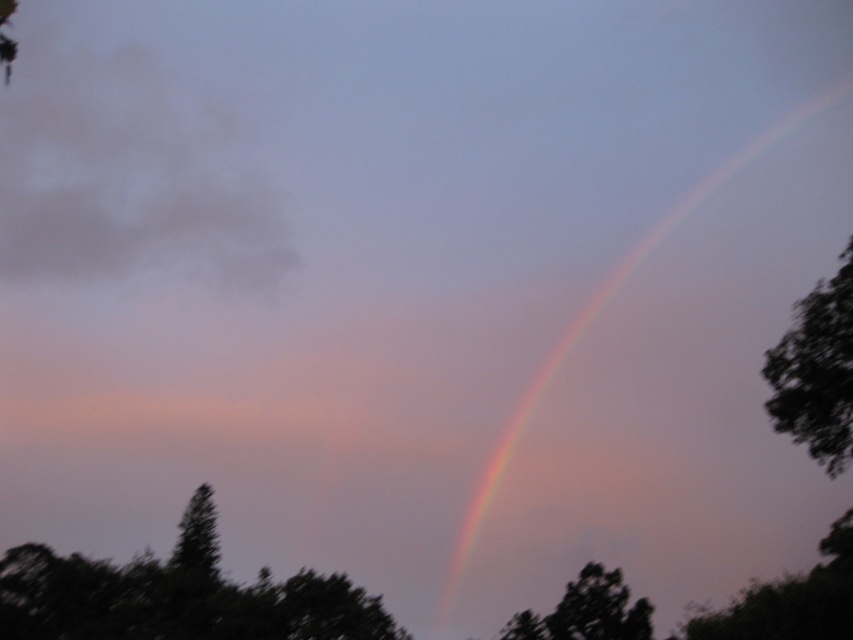
You are an astronomer observing the sky scene. You notice two points marked at coordinates point [851,448] and point [477,488]. Which point is positioned closer to your viewpoint?

Point [851,448] is closer to the viewer than point [477,488].

Looking at this image, you are an ornithologist observing birds in the dark green leafy tree at lower left and dark green leafy tree at right. Which tree would require a wider net to capture a bird if you need to cover the entire width of the tree?

The dark green leafy tree at lower left has a greater width than the dark green leafy tree at right, so a wider net would be needed for the dark green leafy tree at lower left to cover its entire width.

You are an ornithologist observing birds from a viewpoint. You notice a dark green leafy tree at right and a rainbow at upper right. Which object appears taller in the sky?

The rainbow at upper right appears taller than the dark green leafy tree at right because the dark green leafy tree at right is not as tall as rainbow at upper right.